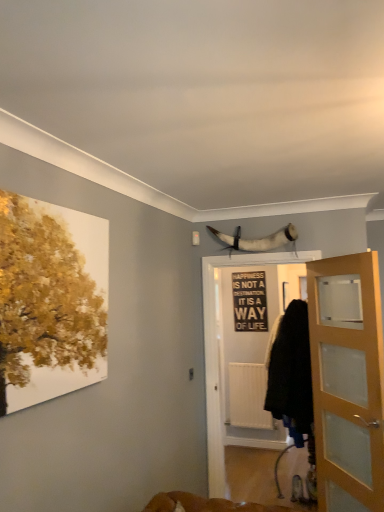
Question: Should I look upward or downward to see black fabric screen door at center?

Choices:
 (A) up
 (B) down

Answer: (B)

Question: Considering the relative positions of white horn at upper center and black matte signboard at center in the image provided, is white horn at upper center to the right of black matte signboard at center from the viewer's perspective?

Choices:
 (A) no
 (B) yes

Answer: (A)

Question: Is white horn at upper center smaller than black matte signboard at center?

Choices:
 (A) yes
 (B) no

Answer: (B)

Question: Is white horn at upper center taller than black matte signboard at center?

Choices:
 (A) no
 (B) yes

Answer: (A)

Question: Can you confirm if white horn at upper center is wider than black matte signboard at center?

Choices:
 (A) no
 (B) yes

Answer: (B)

Question: Is white horn at upper center with black matte signboard at center?

Choices:
 (A) yes
 (B) no

Answer: (B)

Question: Is white horn at upper center far from black matte signboard at center?

Choices:
 (A) no
 (B) yes

Answer: (B)

Question: Does white matte radiator at center have a lesser width compared to light brown wooden door at right?

Choices:
 (A) yes
 (B) no

Answer: (A)

Question: Is white matte radiator at center far from light brown wooden door at right?

Choices:
 (A) yes
 (B) no

Answer: (A)

Question: Is white matte radiator at center further to camera compared to light brown wooden door at right?

Choices:
 (A) no
 (B) yes

Answer: (B)

Question: Considering the relative sizes of white matte radiator at center and light brown wooden door at right in the image provided, is white matte radiator at center bigger than light brown wooden door at right?

Choices:
 (A) no
 (B) yes

Answer: (A)

Question: Can you confirm if white matte radiator at center is smaller than light brown wooden door at right?

Choices:
 (A) no
 (B) yes

Answer: (B)

Question: Does white matte radiator at center have a greater width compared to light brown wooden door at right?

Choices:
 (A) yes
 (B) no

Answer: (B)

Question: Considering the relative positions of black fabric screen door at center and white matte radiator at center in the image provided, is black fabric screen door at center to the left of white matte radiator at center from the viewer's perspective?

Choices:
 (A) no
 (B) yes

Answer: (B)